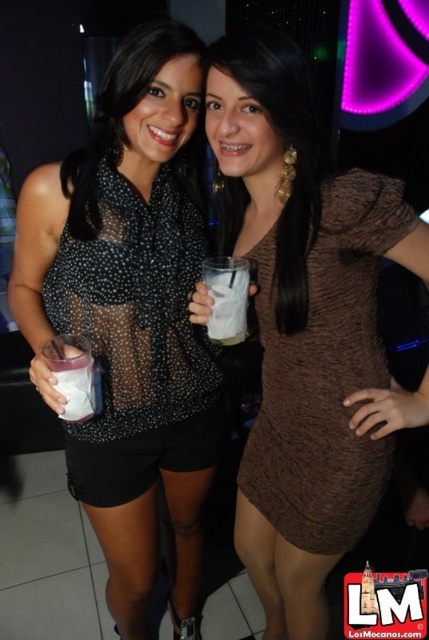
Does black sheer top at center appear over white frothy drink at center?

Incorrect, black sheer top at center is not positioned above white frothy drink at center.

Between black sheer top at center and white frothy drink at center, which one appears on the right side from the viewer's perspective?

white frothy drink at center

Between point (21, 244) and point (214, 340), which one is positioned behind?

Point (21, 244)

The image size is (429, 640). Identify the location of black sheer top at center. (130, 316).

Looking at this image, does black sheer top at center appear under white opaque cup at lower left?

Yes.

Is black sheer top at center positioned behind white opaque cup at lower left?

Yes.

Identify the location of black sheer top at center. pos(130,316).

Is black sheer top at center bigger than sheer black blouse at center?

Yes.

Who is more forward, (x=169, y=257) or (x=214, y=387)?

Point (x=169, y=257) is more forward.

You are a GUI agent. You are given a task and a screenshot of the screen. Output one action in this format:
    pyautogui.click(x=<x>, y=<y>)
    Task: Click on the black sheer top at center
    The height and width of the screenshot is (640, 429).
    Given the screenshot: What is the action you would take?
    pyautogui.click(x=130, y=316)